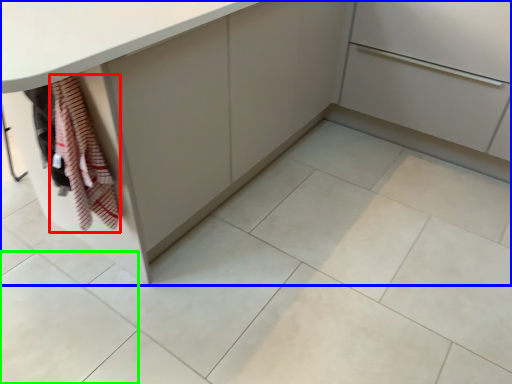
Question: Based on their relative distances, which object is farther from blanket (highlighted by a red box)? Choose from cabinetry (highlighted by a blue box) and ceramic tile (highlighted by a green box).

Choices:
 (A) cabinetry
 (B) ceramic tile

Answer: (A)